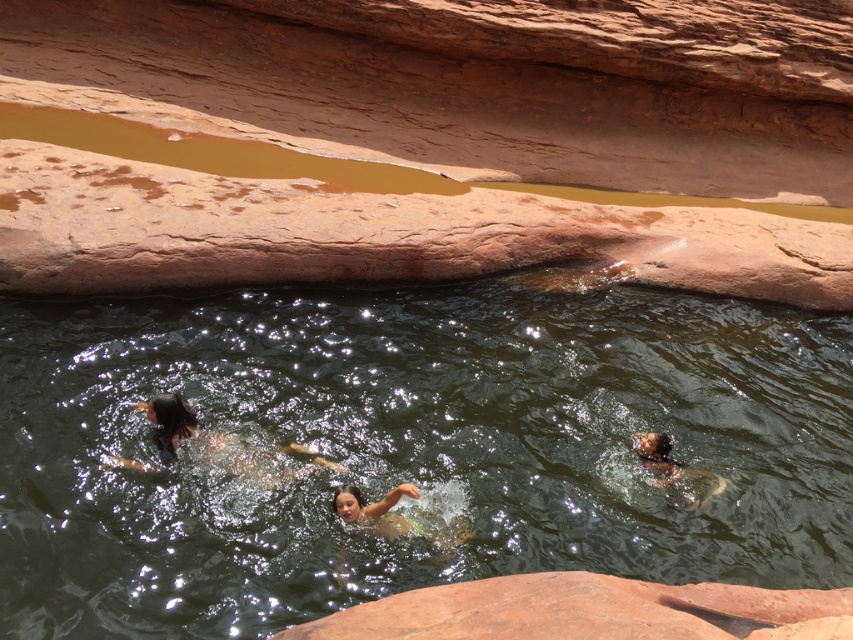
You are standing at the edge of the canyon pool and want to reach the point closer to you. Which point should you aim for, point (650, 429) or point (697, 476)?

You should aim for point (650, 429) because it is closer to you than point (697, 476).

You are a photographer standing at the edge of the canyon pool. You want to take a photo that includes both the brown fur dog at center and the smooth brown skin at lower right. Which subject should you focus on first if you want to ensure both are in the frame?

The brown fur dog at center is taller than the smooth brown skin at lower right, so you should focus on the brown fur dog at center first to ensure both are in the frame.

Based on the photo, you are standing on the edge of the canyon pool and want to walk to the smooth brown skin at lower right without stepping into the greenish water at center. Is this possible?

The greenish water at center is to the left of the smooth brown skin at lower right, so you can walk around the water on the right side to reach the smooth brown skin at lower right without stepping into the water.